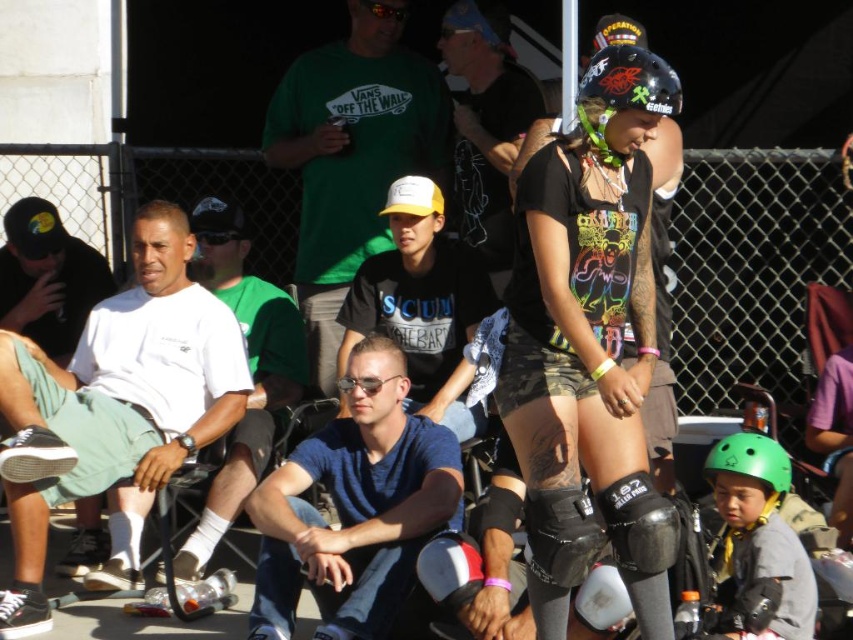
Question: Which of the following is the closest to the observer?

Choices:
 (A) (329, 556)
 (B) (614, 552)

Answer: (B)

Question: Considering the relative positions of blue cotton shirt at center and black matte knee pad at lower center in the image provided, where is blue cotton shirt at center located with respect to black matte knee pad at lower center?

Choices:
 (A) above
 (B) below

Answer: (A)

Question: Is light green cotton shorts at left further to camera compared to black matte helmet at center?

Choices:
 (A) no
 (B) yes

Answer: (B)

Question: Does blue cotton shirt at center come in front of black matte shirt at center?

Choices:
 (A) no
 (B) yes

Answer: (B)

Question: Which point is farther from the camera taking this photo?

Choices:
 (A) [659, 529]
 (B) [366, 464]
 (C) [634, 74]

Answer: (B)

Question: Which object appears closest to the camera in this image?

Choices:
 (A) white cotton t-shirt at left
 (B) light green cotton shorts at left

Answer: (A)